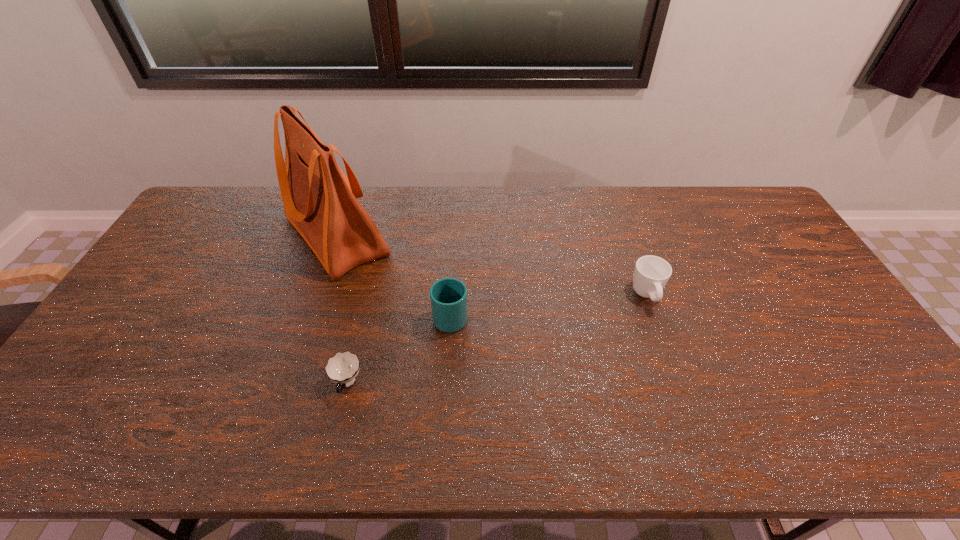
Identify which cup is the third nearest to the tallest object. Please provide its 2D coordinates. Your answer should be formatted as a tuple, i.e. [(x, y)], where the tuple contains the x and y coordinates of a point satisfying the conditions above.

[(651, 273)]

Locate an element on the screen. the closest cup to the rightmost cup is located at coordinates (448, 296).